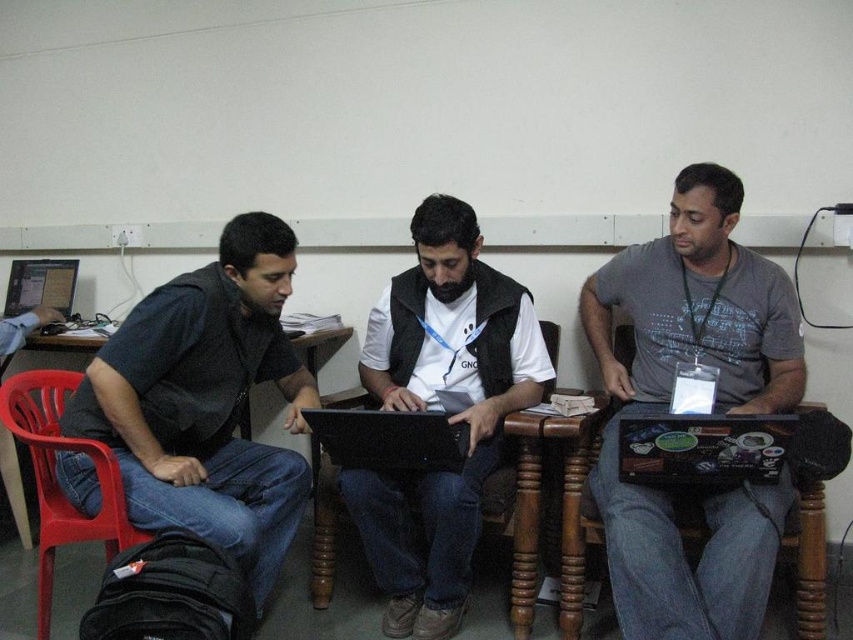
Question: Is dark gray vest at left thinner than matte black laptop at center?

Choices:
 (A) yes
 (B) no

Answer: (A)

Question: Which object is positioned closest to the matte black laptop at left?

Choices:
 (A) gray matte shirt at center
 (B) black glossy laptop at center
 (C) dark gray vest at left
 (D) plastic chair at left

Answer: (D)

Question: Which object is farther from the camera taking this photo?

Choices:
 (A) black plastic laptop at lower right
 (B) matte black laptop at left
 (C) plastic chair at left
 (D) matte black laptop at center

Answer: (B)

Question: Can you confirm if dark gray vest at left is positioned to the left of black glossy laptop at center?

Choices:
 (A) no
 (B) yes

Answer: (B)

Question: Which object is the closest to the gray matte shirt at center?

Choices:
 (A) matte black laptop at center
 (B) black glossy laptop at center
 (C) matte black laptop at left
 (D) plastic chair at left

Answer: (A)

Question: Observing the image, what is the correct spatial positioning of dark gray vest at left in reference to black glossy laptop at center?

Choices:
 (A) left
 (B) right

Answer: (A)